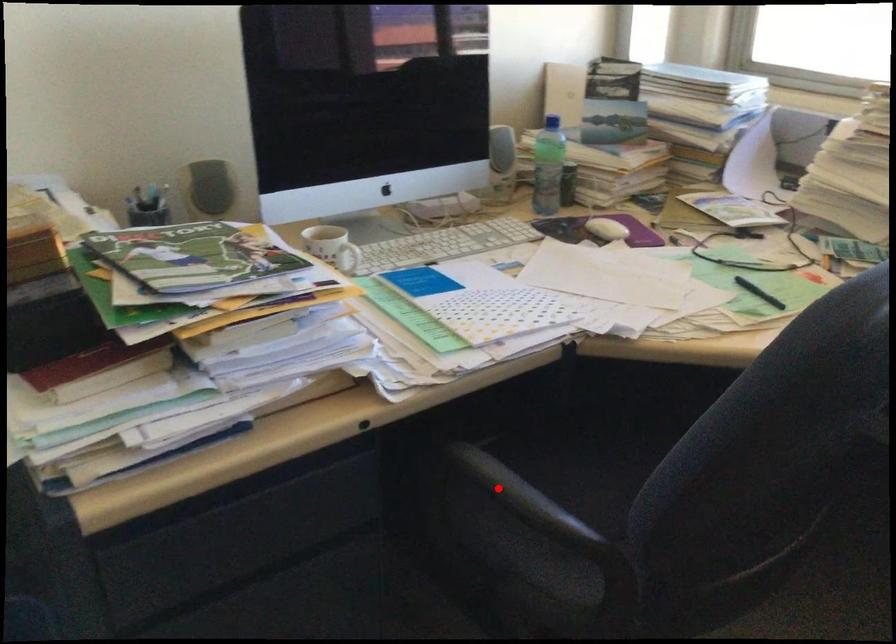
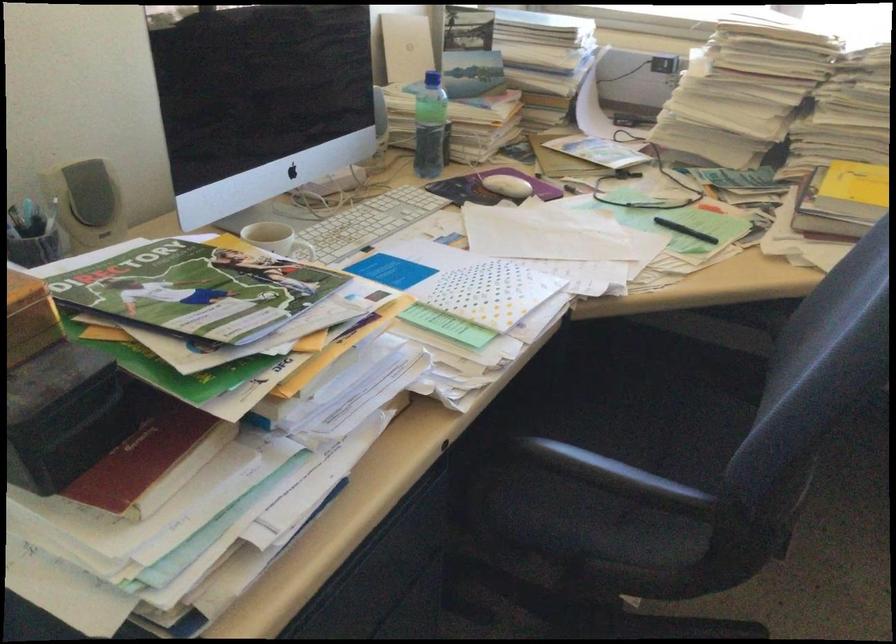
Find the pixel in the second image that matches the highlighted location in the first image.

(614, 474)